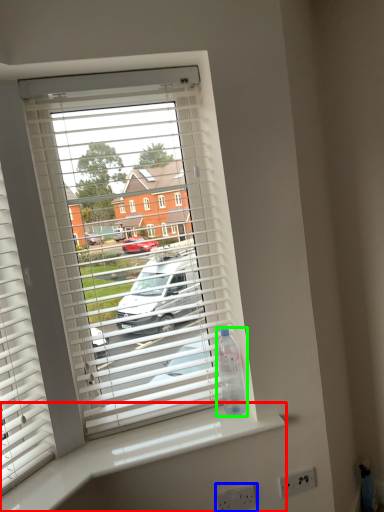
Question: Which is farther away from counter top (highlighted by a red box)? electric outlet (highlighted by a blue box) or bottle (highlighted by a green box)?

Choices:
 (A) electric outlet
 (B) bottle

Answer: (A)